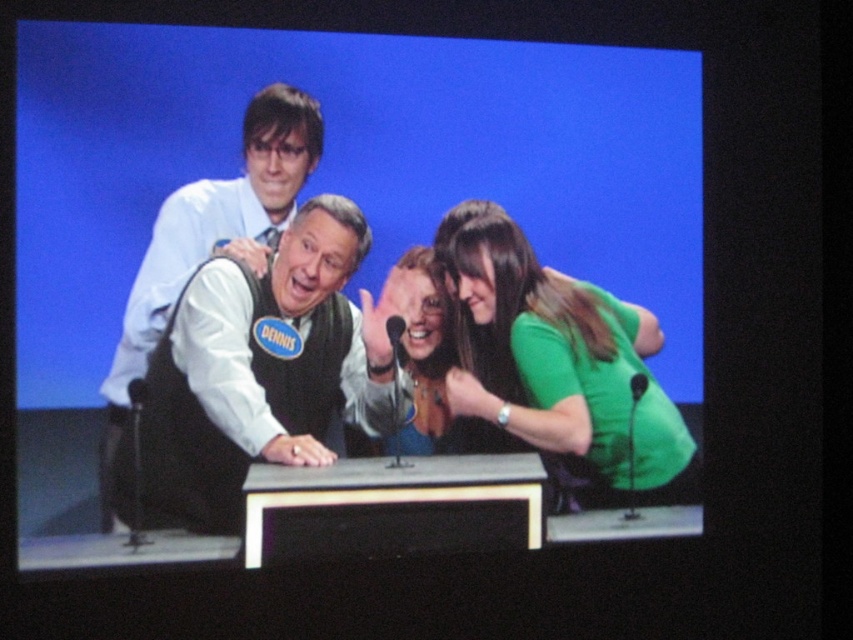
Question: Considering the real-world distances, which object is farthest from the matte black podium at center?

Choices:
 (A) white shirt at center
 (B) green matte shirt at right

Answer: (B)

Question: Is matte black podium at center thinner than green matte shirt at right?

Choices:
 (A) yes
 (B) no

Answer: (B)

Question: Estimate the real-world distances between objects in this image. Which object is farther from the matte green dress at center?

Choices:
 (A) matte black podium at center
 (B) white shirt at center

Answer: (A)

Question: Does white shirt at center lie in front of matte green dress at center?

Choices:
 (A) no
 (B) yes

Answer: (B)

Question: Is matte black podium at center to the right of green matte shirt at right from the viewer's perspective?

Choices:
 (A) yes
 (B) no

Answer: (B)

Question: Which object is the closest to the white shirt at center?

Choices:
 (A) matte green dress at center
 (B) matte black podium at center
 (C) green matte shirt at right

Answer: (A)